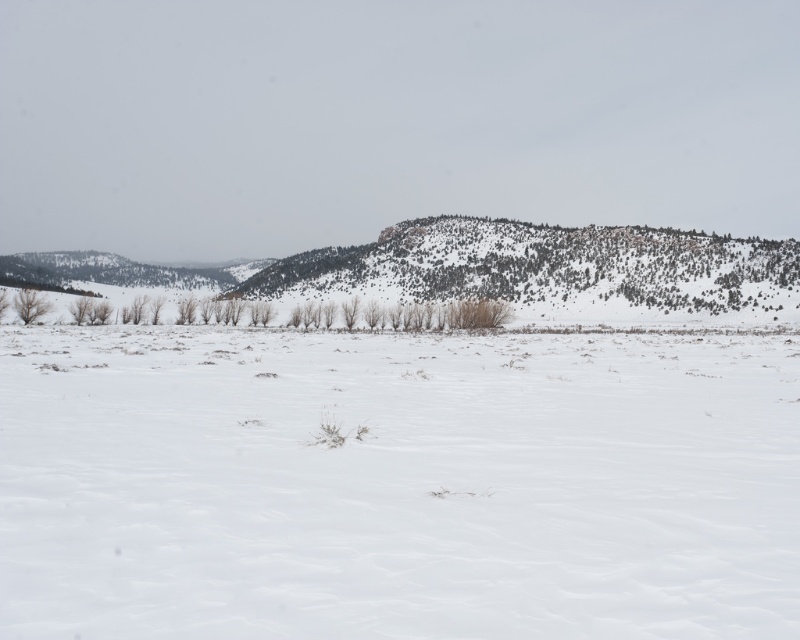
Which is more to the left, white fluffy snow at center or green textured hill at center?

white fluffy snow at center is more to the left.

Where is `white fluffy snow at center`? white fluffy snow at center is located at coordinates (396, 484).